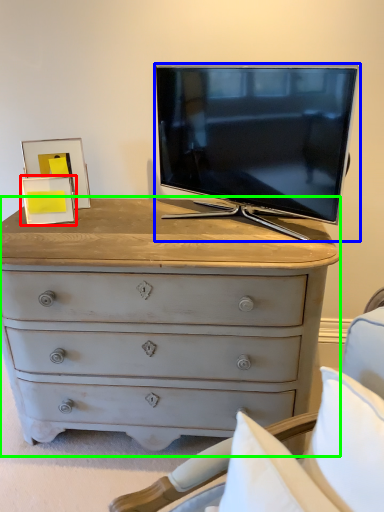
Question: Which is farther away from picture frame (highlighted by a red box)? television (highlighted by a blue box) or chest of drawers (highlighted by a green box)?

Choices:
 (A) television
 (B) chest of drawers

Answer: (A)